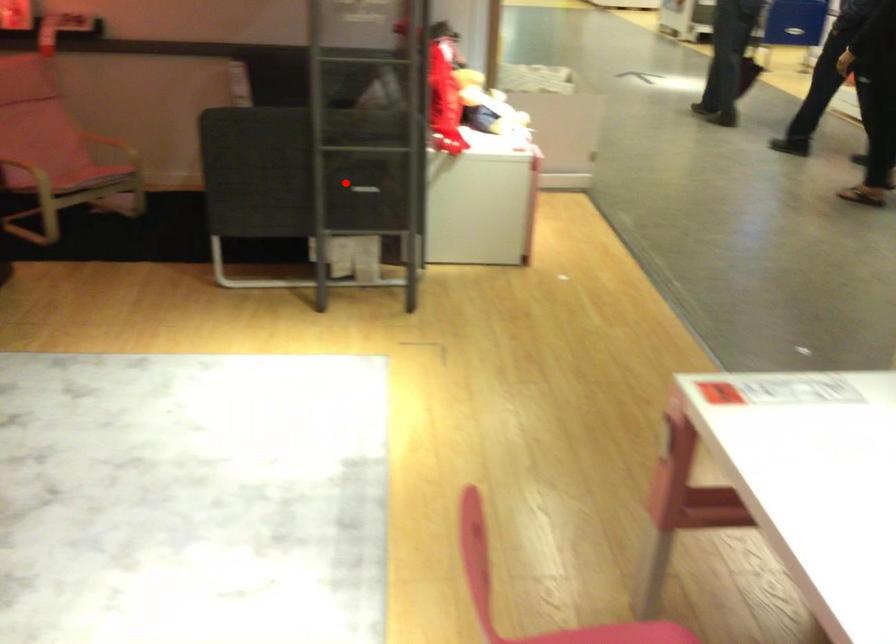
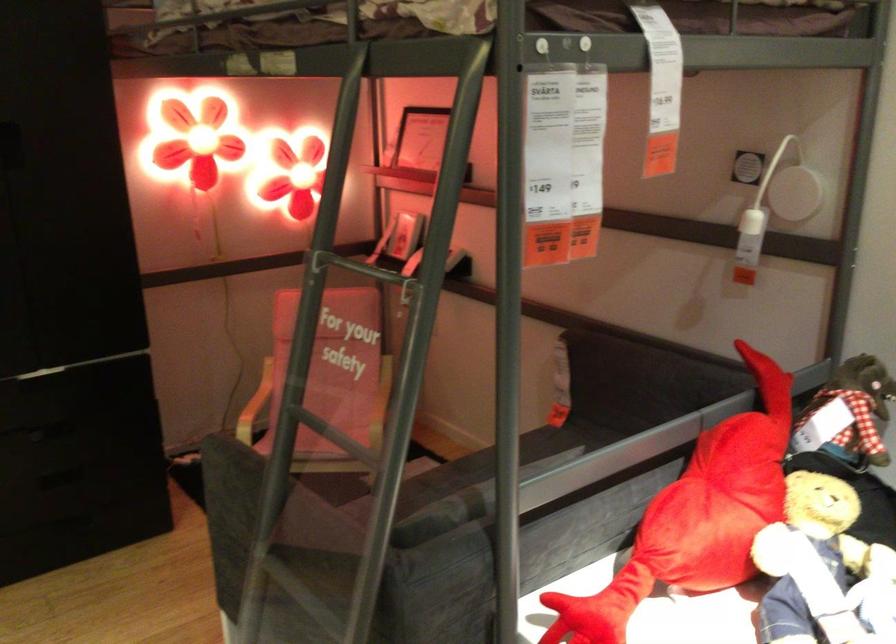
Question: A red point is marked in image1. In image2, is the corresponding 3D point closer to the camera or farther? Reply with the corresponding letter.

Choices:
 (A) The corresponding 3D point is closer.
 (B) The corresponding 3D point is farther.

Answer: (A)